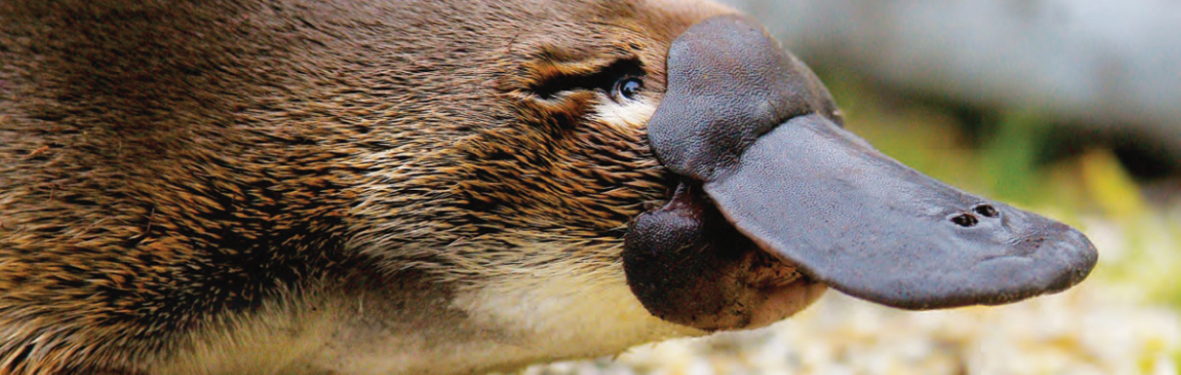
This screenshot has height=375, width=1181. What are the coordinates of `1 area of green plant life` in the screenshot? It's located at (1020, 147).